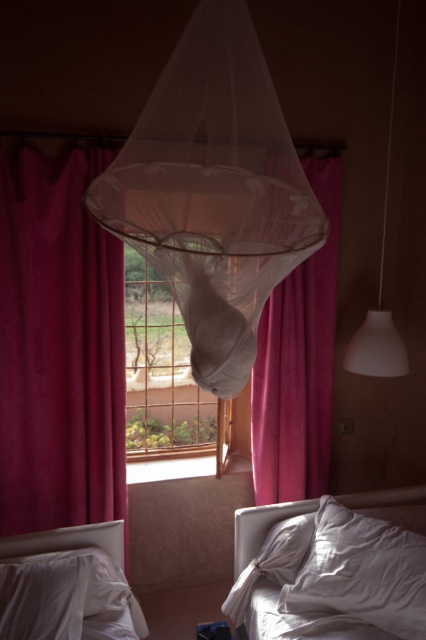
Who is higher up, white soft bed at lower right or white soft pillow at lower center?

white soft bed at lower right is higher up.

Between point (291, 515) and point (233, 618), which one is positioned behind?

Positioned behind is point (291, 515).

At what (x,y) coordinates should I click in order to perform the action: click on white soft bed at lower right. Please return your answer as a coordinate pair (x, y). Image resolution: width=426 pixels, height=640 pixels. Looking at the image, I should click on (333, 577).

Who is shorter, velvet magenta curtain at left or white soft pillow at lower left?

white soft pillow at lower left is shorter.

Is velvet magenta curtain at left to the left of white soft pillow at lower left from the viewer's perspective?

Correct, you'll find velvet magenta curtain at left to the left of white soft pillow at lower left.

Is point (108, 262) more distant than point (5, 570)?

Yes, it is behind point (5, 570).

In order to click on velvet magenta curtain at left in this screenshot , I will do `click(58, 348)`.

Is white soft bed at lower right closer to camera compared to white soft bed at lower left?

No, white soft bed at lower right is further to the viewer.

Is point (226, 600) positioned before point (100, 588)?

No, (226, 600) is behind (100, 588).

Who is more forward, (282, 573) or (126, 596)?

Point (126, 596) is more forward.

What are the coordinates of `white soft bed at lower right` in the screenshot? It's located at (333, 577).